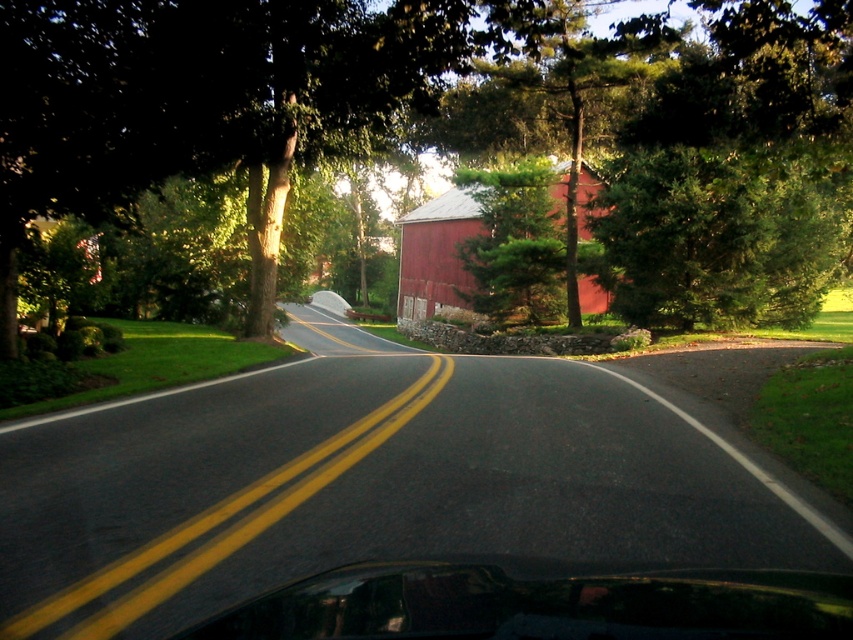
You are driving a car and looking at the road ahead. There is a point marked at coordinates (213, 99). What object is located at that point?

The green leafy tree at upper center is located at point (213, 99).

You are driving a car and want to park near the green leafy tree at upper center and the smooth red barn at center. Which one is closer to your current position?

The green leafy tree at upper center is closer to the viewer than the smooth red barn at center, so the green leafy tree at upper center is closer to your current position.